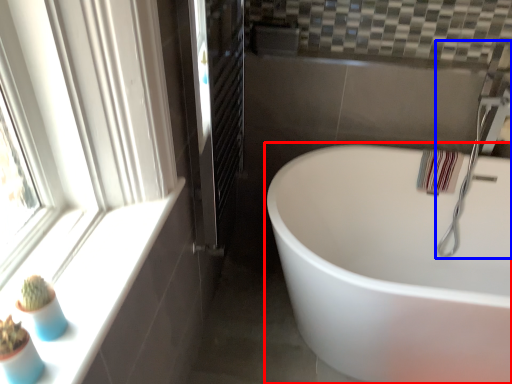
Question: Which object appears closest to the camera in this image, bathtub (highlighted by a red box) or faucet (highlighted by a blue box)?

Choices:
 (A) bathtub
 (B) faucet

Answer: (A)